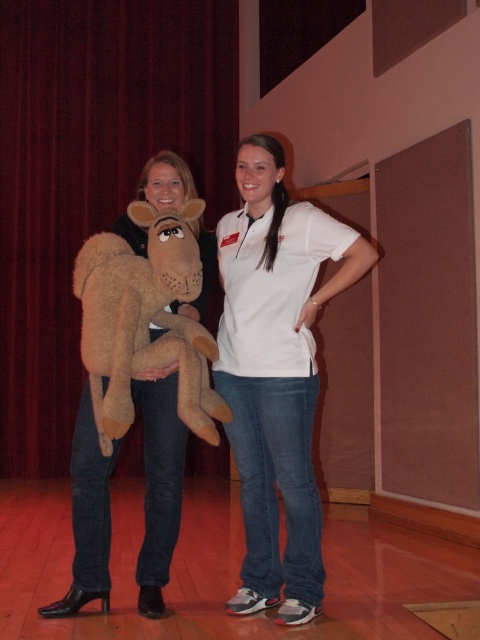
Can you confirm if white cotton shirt at center is positioned to the left of brown plush toy at center?

In fact, white cotton shirt at center is to the right of brown plush toy at center.

Which of these two, white cotton shirt at center or brown plush toy at center, stands shorter?

brown plush toy at center

At what (x,y) coordinates should I click in order to perform the action: click on white cotton shirt at center. Please return your answer as a coordinate pair (x, y). This screenshot has height=640, width=480. Looking at the image, I should click on (276, 372).

Who is lower down, dark red velvet curtain at upper left or white cotton shirt at center?

white cotton shirt at center

Which is behind, point (156, 131) or point (334, 284)?

Point (156, 131)

This screenshot has width=480, height=640. What do you see at coordinates (92, 173) in the screenshot? I see `dark red velvet curtain at upper left` at bounding box center [92, 173].

The width and height of the screenshot is (480, 640). Identify the location of dark red velvet curtain at upper left. (92, 173).

Does brown plush toy at center have a larger size compared to brown plush toy at left?

Yes.

Can you confirm if brown plush toy at center is wider than brown plush toy at left?

Correct, the width of brown plush toy at center exceeds that of brown plush toy at left.

The image size is (480, 640). Describe the element at coordinates (144, 321) in the screenshot. I see `brown plush toy at center` at that location.

Locate an element on the screen. brown plush toy at center is located at coordinates (144, 321).